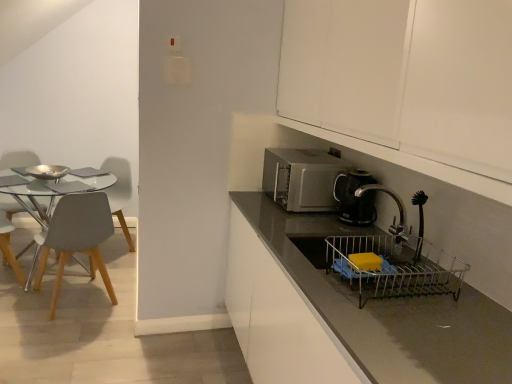
Where is `free space in front of metallic silver sink at lower right`? The width and height of the screenshot is (512, 384). free space in front of metallic silver sink at lower right is located at coordinates (422, 341).